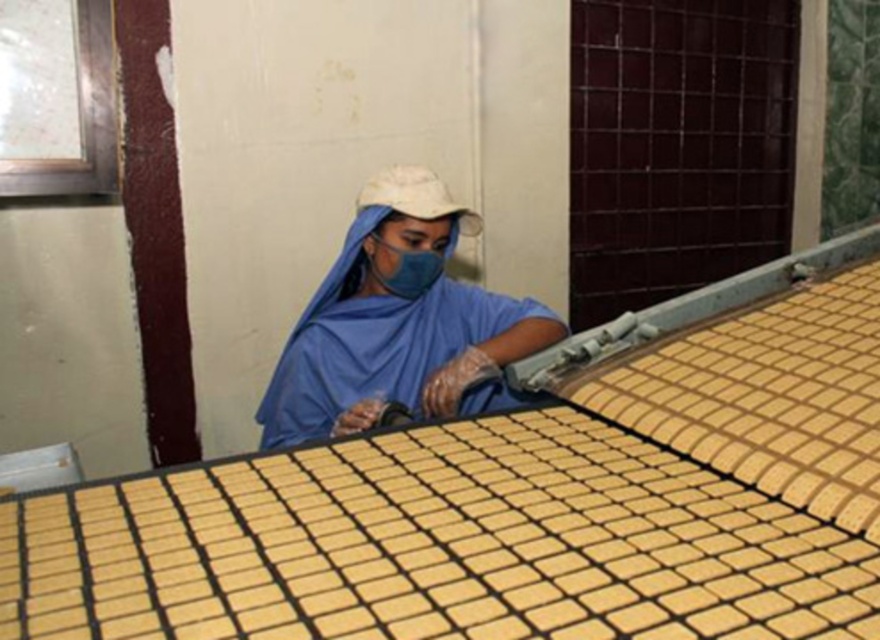
Looking at this image, is blue fabric robe at center taller than blue fabric mask at center?

Yes.

Is blue fabric robe at center in front of blue fabric mask at center?

No.

Who is more forward, (335,364) or (418,221)?

Point (418,221) is in front.

Locate an element on the screen. blue fabric robe at center is located at coordinates (374, 342).